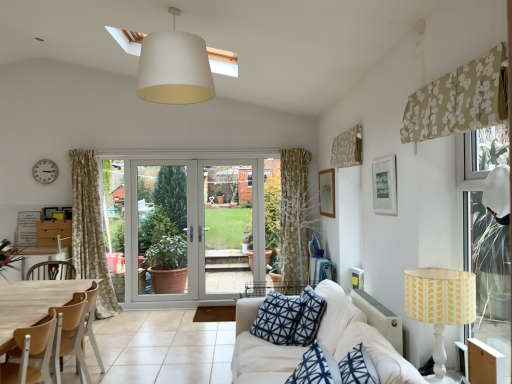
Question: Does yellow fabric lampshade at right have a lesser height compared to floral fabric curtain at upper right, the second curtain positioned from the front?

Choices:
 (A) no
 (B) yes

Answer: (A)

Question: Is floral fabric curtain at upper right, marked as the first curtain in a back-to-front arrangement, at the back of yellow fabric lampshade at right?

Choices:
 (A) no
 (B) yes

Answer: (A)

Question: Does yellow fabric lampshade at right have a larger size compared to floral fabric curtain at upper right, marked as the first curtain in a back-to-front arrangement?

Choices:
 (A) yes
 (B) no

Answer: (A)

Question: Considering the relative sizes of yellow fabric lampshade at right and floral fabric curtain at upper right, marked as the first curtain in a back-to-front arrangement, in the image provided, is yellow fabric lampshade at right smaller than floral fabric curtain at upper right, marked as the first curtain in a back-to-front arrangement,?

Choices:
 (A) yes
 (B) no

Answer: (B)

Question: Is the depth of yellow fabric lampshade at right less than that of floral fabric curtain at upper right, the second curtain positioned from the front?

Choices:
 (A) yes
 (B) no

Answer: (A)

Question: Does point (183, 264) appear closer or farther from the camera than point (456, 324)?

Choices:
 (A) farther
 (B) closer

Answer: (A)

Question: Relative to yellow fabric lampshade at right, is white plastic screen door at center in front or behind?

Choices:
 (A) front
 (B) behind

Answer: (B)

Question: From their relative heights in the image, would you say white plastic screen door at center is taller or shorter than yellow fabric lampshade at right?

Choices:
 (A) short
 (B) tall

Answer: (B)

Question: Is white plastic screen door at center inside or outside of yellow fabric lampshade at right?

Choices:
 (A) outside
 (B) inside

Answer: (A)

Question: From a real-world perspective, is matte white picture frame at upper right, the second picture frame in the back-to-front sequence, above or below yellow fabric lampshade at right?

Choices:
 (A) above
 (B) below

Answer: (A)

Question: Considering the relative positions of matte white picture frame at upper right, which is counted as the second picture frame, starting from the left, and yellow fabric lampshade at right in the image provided, is matte white picture frame at upper right, which is counted as the second picture frame, starting from the left, to the left or to the right of yellow fabric lampshade at right?

Choices:
 (A) right
 (B) left

Answer: (B)

Question: Looking at their shapes, would you say matte white picture frame at upper right, which ranks as the 1th picture frame in front-to-back order, is wider or thinner than yellow fabric lampshade at right?

Choices:
 (A) thin
 (B) wide

Answer: (A)

Question: In terms of height, does matte white picture frame at upper right, the second picture frame in the back-to-front sequence, look taller or shorter compared to yellow fabric lampshade at right?

Choices:
 (A) tall
 (B) short

Answer: (B)

Question: Is point (47, 168) positioned closer to the camera than point (163, 99)?

Choices:
 (A) closer
 (B) farther

Answer: (B)

Question: From the image's perspective, relative to white fabric lampshade at upper center, is silver metallic clock at upper left above or below?

Choices:
 (A) above
 (B) below

Answer: (B)